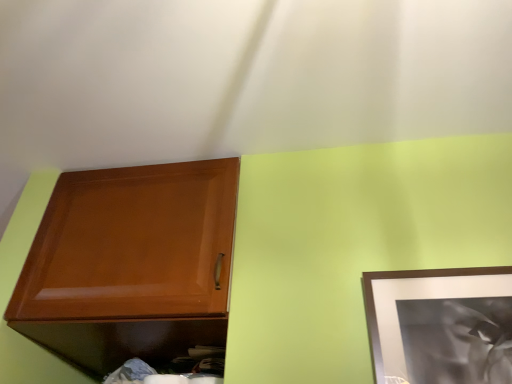
This screenshot has height=384, width=512. What do you see at coordinates (441, 325) in the screenshot? I see `matte silver picture frame at upper right` at bounding box center [441, 325].

Where is `matte silver picture frame at upper right`? matte silver picture frame at upper right is located at coordinates (441, 325).

Measure the distance between point (397, 368) and camera.

Point (397, 368) is 35.94 inches away from camera.

The image size is (512, 384). Describe the element at coordinates (130, 264) in the screenshot. I see `glossy wood cabinet at upper left` at that location.

What are the coordinates of `glossy wood cabinet at upper left` in the screenshot? It's located at [130, 264].

This screenshot has width=512, height=384. Identify the location of matte silver picture frame at upper right. (441, 325).

Based on the photo, is glossy wood cabinet at upper left to the right of matte silver picture frame at upper right from the viewer's perspective?

No.

Does glossy wood cabinet at upper left lie behind matte silver picture frame at upper right?

Yes, the depth of glossy wood cabinet at upper left is greater than that of matte silver picture frame at upper right.

Considering the positions of point (94, 336) and point (484, 381), is point (94, 336) closer or farther from the camera than point (484, 381)?

Point (94, 336) appears to be farther away from the viewer than point (484, 381).

From the image's perspective, which one is positioned lower, glossy wood cabinet at upper left or matte silver picture frame at upper right?

glossy wood cabinet at upper left.

From the picture: From a real-world perspective, between glossy wood cabinet at upper left and matte silver picture frame at upper right, who is vertically lower?

In real-world perspective, matte silver picture frame at upper right is lower.

Which object is thinner, glossy wood cabinet at upper left or matte silver picture frame at upper right?

matte silver picture frame at upper right.

Who is shorter, glossy wood cabinet at upper left or matte silver picture frame at upper right?

matte silver picture frame at upper right.

Does glossy wood cabinet at upper left have a larger size compared to matte silver picture frame at upper right?

Indeed, glossy wood cabinet at upper left has a larger size compared to matte silver picture frame at upper right.

Which is correct: glossy wood cabinet at upper left is inside matte silver picture frame at upper right, or outside of it?

glossy wood cabinet at upper left lies outside matte silver picture frame at upper right.

Is glossy wood cabinet at upper left directly adjacent to matte silver picture frame at upper right?

No, glossy wood cabinet at upper left is not with matte silver picture frame at upper right.

Is glossy wood cabinet at upper left positioned with its back to matte silver picture frame at upper right?

No.

What's the angular difference between glossy wood cabinet at upper left and matte silver picture frame at upper right's facing directions?

1.1 degrees.

How distant is glossy wood cabinet at upper left from matte silver picture frame at upper right?

glossy wood cabinet at upper left is 24.97 inches from matte silver picture frame at upper right.

You are a GUI agent. You are given a task and a screenshot of the screen. Output one action in this format:
    pyautogui.click(x=<x>, y=<y>)
    Task: Click on the cabinetry above the matte silver picture frame at upper right (from a real-world perspective)
    Image resolution: width=512 pixels, height=384 pixels.
    Given the screenshot: What is the action you would take?
    click(x=130, y=264)

In the image, is matte silver picture frame at upper right on the left side or the right side of glossy wood cabinet at upper left?

Based on their positions, matte silver picture frame at upper right is located to the right of glossy wood cabinet at upper left.

Is matte silver picture frame at upper right in front of or behind glossy wood cabinet at upper left in the image?

matte silver picture frame at upper right is in front of glossy wood cabinet at upper left.

Considering the positions of points (437, 270) and (198, 255), is point (437, 270) farther from camera compared to point (198, 255)?

No, it is not.

From the image's perspective, is matte silver picture frame at upper right positioned above or below glossy wood cabinet at upper left?

Result: Based on their image positions, matte silver picture frame at upper right is located above glossy wood cabinet at upper left.

In the scene shown: From a real-world perspective, is matte silver picture frame at upper right beneath glossy wood cabinet at upper left?

Yes.

Which object is thinner, matte silver picture frame at upper right or glossy wood cabinet at upper left?

With smaller width is matte silver picture frame at upper right.

From their relative heights in the image, would you say matte silver picture frame at upper right is taller or shorter than glossy wood cabinet at upper left?

Considering their sizes, matte silver picture frame at upper right has less height than glossy wood cabinet at upper left.

In the scene shown: Considering the sizes of objects matte silver picture frame at upper right and glossy wood cabinet at upper left in the image provided, who is smaller, matte silver picture frame at upper right or glossy wood cabinet at upper left?

Smaller between the two is matte silver picture frame at upper right.

Is matte silver picture frame at upper right located outside glossy wood cabinet at upper left?

Yes, matte silver picture frame at upper right is outside of glossy wood cabinet at upper left.

Is matte silver picture frame at upper right not close to glossy wood cabinet at upper left?

No, matte silver picture frame at upper right is not far away from glossy wood cabinet at upper left.

Is matte silver picture frame at upper right facing towards glossy wood cabinet at upper left?

No, matte silver picture frame at upper right is not oriented towards glossy wood cabinet at upper left.

Can you tell me how much matte silver picture frame at upper right and glossy wood cabinet at upper left differ in facing direction?

There is a 1.1-degree angle between the facing directions of matte silver picture frame at upper right and glossy wood cabinet at upper left.

Measure the distance from matte silver picture frame at upper right to glossy wood cabinet at upper left.

matte silver picture frame at upper right and glossy wood cabinet at upper left are 24.97 inches apart from each other.

Image resolution: width=512 pixels, height=384 pixels. Identify the location of cabinetry located on the left of matte silver picture frame at upper right. (130, 264).

Find the location of a particular element. The height and width of the screenshot is (384, 512). cabinetry positioned vertically above the matte silver picture frame at upper right (from a real-world perspective) is located at coordinates (130, 264).

The image size is (512, 384). I want to click on picture frame on the right of glossy wood cabinet at upper left, so click(x=441, y=325).